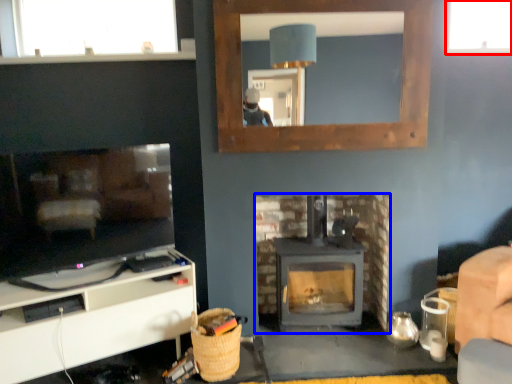
Question: Which of the following is the farthest to the observer, window (highlighted by a red box) or fireplace (highlighted by a blue box)?

Choices:
 (A) window
 (B) fireplace

Answer: (A)